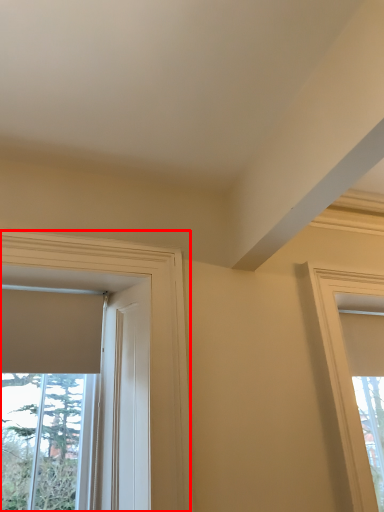
Question: Observing the image, what is the correct spatial positioning of window (annotated by the red box) in reference to window?

Choices:
 (A) right
 (B) left

Answer: (B)